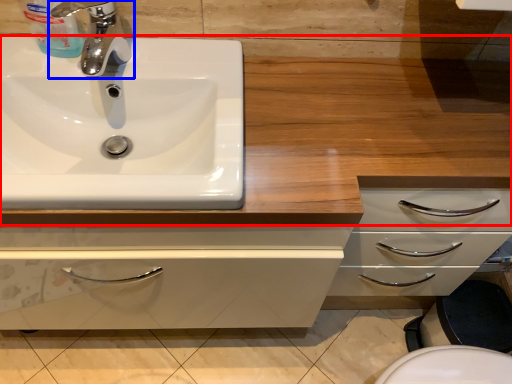
Question: Which point is further to the camera, counter top (highlighted by a red box) or tap (highlighted by a blue box)?

Choices:
 (A) counter top
 (B) tap

Answer: (B)